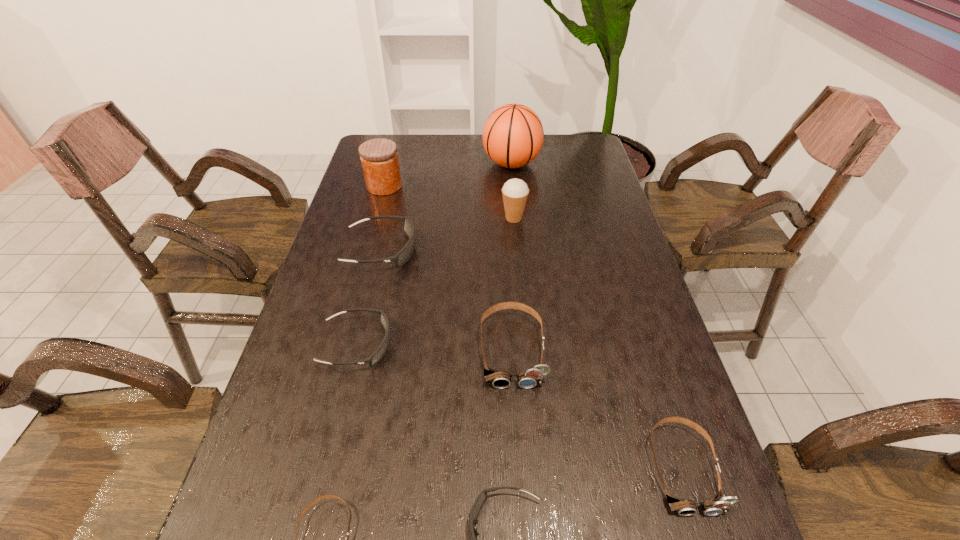
The height and width of the screenshot is (540, 960). I want to click on the rightmost goggles, so click(719, 504).

Locate an element on the screen. free location located on the left of the orange basketball is located at coordinates (452, 164).

I want to click on vacant region located on the front of the orange jar, so click(x=368, y=246).

This screenshot has width=960, height=540. Find the location of `free location located 0.110m on the right of the third farthest object`. free location located 0.110m on the right of the third farthest object is located at coordinates (562, 218).

Identify the location of vacant area located on the lenses of the farthest goggles. The height and width of the screenshot is (540, 960). (487, 251).

Image resolution: width=960 pixels, height=540 pixels. What are the coordinates of `vacant region located 0.170m on the front-facing side of the biggest brown goggles` in the screenshot? It's located at (519, 469).

Identify the location of vacant space situated 0.100m on the lenses of the second biggest black goggles. This screenshot has width=960, height=540. (435, 345).

Where is `object at the far edge`? The height and width of the screenshot is (540, 960). object at the far edge is located at coordinates (513, 135).

Where is `jar located in the left edge section of the desktop`? jar located in the left edge section of the desktop is located at coordinates (379, 158).

Find the location of `object situated at the right edge`. object situated at the right edge is located at coordinates (719, 504).